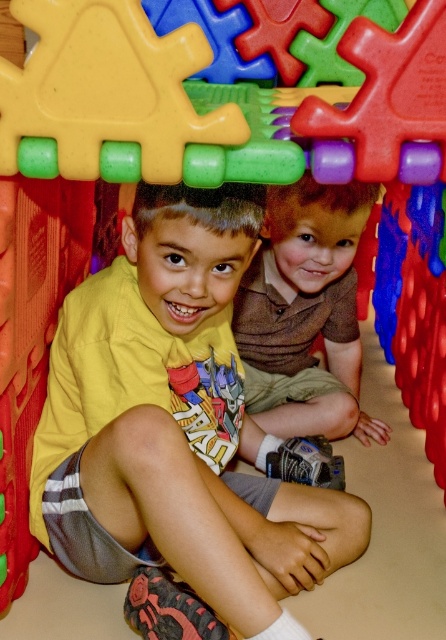
You are a photographer trying to capture both children in a single shot. Since the yellow cotton shirt at center and the brown textured shirt at center are positioned differently, which child should you focus on first to ensure both are in frame?

The yellow cotton shirt at center is taller than the brown textured shirt at center, so focusing on the yellow cotton shirt at center first will ensure the taller child is centered, allowing the shorter brown textured shirt at center to be included in the frame as well.